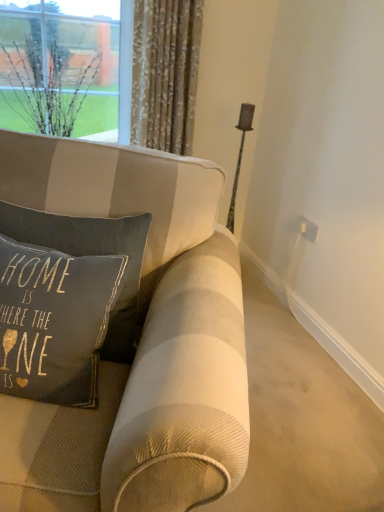
Where is `floral fabric curtain at upper center`? The width and height of the screenshot is (384, 512). floral fabric curtain at upper center is located at coordinates (165, 73).

What do you see at coordinates (308, 229) in the screenshot?
I see `white plastic electric outlet at upper right` at bounding box center [308, 229].

The width and height of the screenshot is (384, 512). I want to click on floral fabric curtain at upper center, so tap(165, 73).

How distant is floral fabric curtain at upper center from clear glass vase at upper left?

floral fabric curtain at upper center is 11.67 inches from clear glass vase at upper left.

Is floral fabric curtain at upper center outside of clear glass vase at upper left?

Indeed, floral fabric curtain at upper center is completely outside clear glass vase at upper left.

From the image's perspective, is floral fabric curtain at upper center above clear glass vase at upper left?

Yes, from the image's perspective, floral fabric curtain at upper center is over clear glass vase at upper left.

In the scene shown: Is floral fabric curtain at upper center at the left side of clear glass vase at upper left?

No, floral fabric curtain at upper center is not to the left of clear glass vase at upper left.

Is dark gray fabric pillow at center at the back of clear glass vase at upper left?

No, dark gray fabric pillow at center is not at the back of clear glass vase at upper left.

Considering the relative sizes of clear glass vase at upper left and dark gray fabric pillow at center in the image provided, is clear glass vase at upper left shorter than dark gray fabric pillow at center?

No, clear glass vase at upper left is not shorter than dark gray fabric pillow at center.

From a real-world perspective, is clear glass vase at upper left above or below dark gray fabric pillow at center?

clear glass vase at upper left is above dark gray fabric pillow at center.

Relative to dark gray fabric pillow at center, is clear glass vase at upper left in front or behind?

clear glass vase at upper left is positioned farther from the viewer than dark gray fabric pillow at center.

Is beige striped fabric couch at center smaller than floral fabric curtain at upper center?

No, beige striped fabric couch at center is not smaller than floral fabric curtain at upper center.

Considering the sizes of objects beige striped fabric couch at center and floral fabric curtain at upper center in the image provided, who is thinner, beige striped fabric couch at center or floral fabric curtain at upper center?

floral fabric curtain at upper center is thinner.

Are beige striped fabric couch at center and floral fabric curtain at upper center far apart?

Indeed, beige striped fabric couch at center is not near floral fabric curtain at upper center.

From the image's perspective, is beige striped fabric couch at center below floral fabric curtain at upper center?

Correct, beige striped fabric couch at center appears lower than floral fabric curtain at upper center in the image.

In the scene shown: Considering the relative sizes of beige striped fabric couch at center and dark gray fabric pillow at center in the image provided, is beige striped fabric couch at center bigger than dark gray fabric pillow at center?

Indeed, beige striped fabric couch at center has a larger size compared to dark gray fabric pillow at center.

You are a GUI agent. You are given a task and a screenshot of the screen. Output one action in this format:
    pyautogui.click(x=<x>, y=<y>)
    Task: Click on the studio couch that is below the dark gray fabric pillow at center (from the image's perspective)
    The image size is (384, 512).
    Given the screenshot: What is the action you would take?
    pyautogui.click(x=158, y=314)

Can you tell me how much beige striped fabric couch at center and dark gray fabric pillow at center differ in facing direction?

The angular difference between beige striped fabric couch at center and dark gray fabric pillow at center is 0.982 degrees.

Does beige striped fabric couch at center have a lesser height compared to dark gray fabric pillow at center?

No, beige striped fabric couch at center is not shorter than dark gray fabric pillow at center.

From a real-world perspective, is floral fabric curtain at upper center on white plastic electric outlet at upper right?

Correct, in the physical world, floral fabric curtain at upper center is higher than white plastic electric outlet at upper right.

Is floral fabric curtain at upper center smaller than white plastic electric outlet at upper right?

Actually, floral fabric curtain at upper center might be larger than white plastic electric outlet at upper right.

Considering the positions of objects floral fabric curtain at upper center and white plastic electric outlet at upper right in the image provided, who is in front, floral fabric curtain at upper center or white plastic electric outlet at upper right?

floral fabric curtain at upper center.

Based on the photo, is white plastic electric outlet at upper right a part of floral fabric curtain at upper center?

Actually, white plastic electric outlet at upper right is outside floral fabric curtain at upper center.

Could you tell me if dark gray fabric pillow at center is turned towards clear glass vase at upper left?

No, dark gray fabric pillow at center is not aimed at clear glass vase at upper left.

Is dark gray fabric pillow at center thinner than clear glass vase at upper left?

Yes.

Are dark gray fabric pillow at center and clear glass vase at upper left located far from each other?

Indeed, dark gray fabric pillow at center is not near clear glass vase at upper left.

From the image's perspective, relative to clear glass vase at upper left, is beige striped fabric couch at center above or below?

Clearly, from the image's perspective, beige striped fabric couch at center is below clear glass vase at upper left.

Which is more to the right, beige striped fabric couch at center or clear glass vase at upper left?

beige striped fabric couch at center is more to the right.

Between beige striped fabric couch at center and clear glass vase at upper left, which one has larger width?

With larger width is beige striped fabric couch at center.

Is beige striped fabric couch at center facing away from clear glass vase at upper left?

Yes, beige striped fabric couch at center is facing away from clear glass vase at upper left.

Identify the location of window on the left of the floral fabric curtain at upper center. (66, 70).

Where is `window behind the dark gray fabric pillow at center`? The width and height of the screenshot is (384, 512). window behind the dark gray fabric pillow at center is located at coordinates (66, 70).

Which object lies further to the anchor point white plastic electric outlet at upper right, floral fabric curtain at upper center or beige striped fabric couch at center?

Based on the image, beige striped fabric couch at center appears to be further to white plastic electric outlet at upper right.

Looking at the image, which one is located further to beige striped fabric couch at center, clear glass vase at upper left or white plastic electric outlet at upper right?

The object further to beige striped fabric couch at center is white plastic electric outlet at upper right.

In the scene shown: When comparing their distances from beige striped fabric couch at center, does floral fabric curtain at upper center or clear glass vase at upper left seem closer?

floral fabric curtain at upper center is closer to beige striped fabric couch at center.

Based on the photo, considering their positions, is dark gray fabric pillow at center positioned closer to white plastic electric outlet at upper right than beige striped fabric couch at center?

Among the two, beige striped fabric couch at center is located nearer to white plastic electric outlet at upper right.

Considering their positions, is beige striped fabric couch at center positioned further to dark gray fabric pillow at center than floral fabric curtain at upper center?

floral fabric curtain at upper center is further to dark gray fabric pillow at center.

When comparing their distances from clear glass vase at upper left, does beige striped fabric couch at center or floral fabric curtain at upper center seem further?

beige striped fabric couch at center is positioned further to the anchor clear glass vase at upper left.

When comparing their distances from clear glass vase at upper left, does dark gray fabric pillow at center or white plastic electric outlet at upper right seem closer?

dark gray fabric pillow at center.

Estimate the real-world distances between objects in this image. Which object is further from floral fabric curtain at upper center, white plastic electric outlet at upper right or dark gray fabric pillow at center?

The object further to floral fabric curtain at upper center is dark gray fabric pillow at center.

Where is `window between beige striped fabric couch at center and white plastic electric outlet at upper right in the front-back direction`? Image resolution: width=384 pixels, height=512 pixels. window between beige striped fabric couch at center and white plastic electric outlet at upper right in the front-back direction is located at coordinates (66, 70).

At what (x,y) coordinates should I click in order to perform the action: click on window that lies between floral fabric curtain at upper center and dark gray fabric pillow at center from top to bottom. Please return your answer as a coordinate pair (x, y). The width and height of the screenshot is (384, 512). Looking at the image, I should click on (66, 70).

I want to click on curtain positioned between dark gray fabric pillow at center and white plastic electric outlet at upper right from near to far, so click(x=165, y=73).

This screenshot has height=512, width=384. Find the location of `pillow between clear glass vase at upper left and white plastic electric outlet at upper right in the horizontal direction`. pillow between clear glass vase at upper left and white plastic electric outlet at upper right in the horizontal direction is located at coordinates (91, 255).